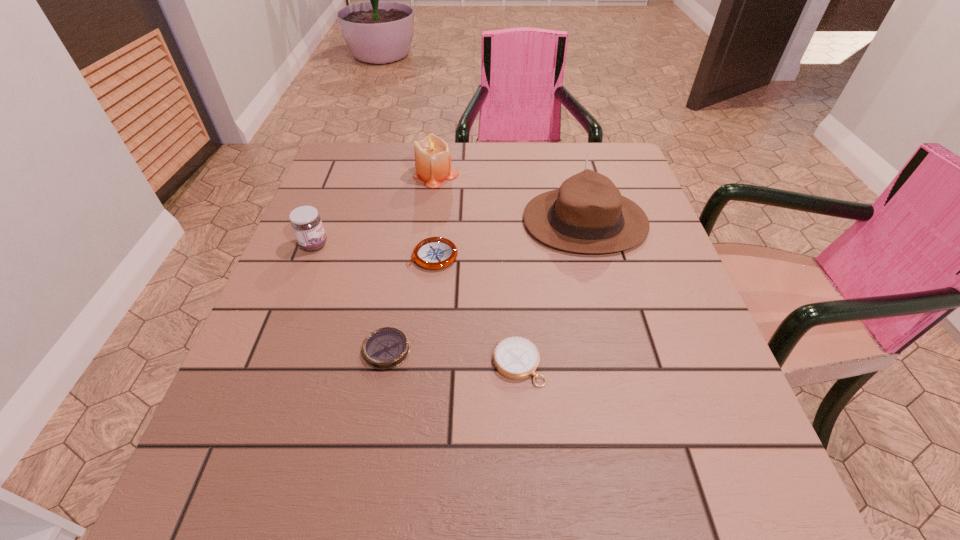
Locate an element on the screen. free region located on the feather side of the fedora is located at coordinates (494, 221).

The image size is (960, 540). Find the location of `free space located 0.280m on the front of the candle`. free space located 0.280m on the front of the candle is located at coordinates (425, 264).

Locate an element on the screen. This screenshot has height=540, width=960. free spot located on the front label of the leftmost object is located at coordinates (505, 245).

The height and width of the screenshot is (540, 960). I want to click on vacant space located on the back of the tallest compass, so click(440, 192).

The image size is (960, 540). What are the coordinates of `free space located on the right of the rightmost compass` in the screenshot? It's located at (617, 364).

At what (x,y) coordinates should I click in order to perform the action: click on blank space located on the front of the shortest object. Please return your answer as a coordinate pair (x, y). Looking at the image, I should click on (367, 463).

At what (x,y) coordinates should I click in order to perform the action: click on object positioned at the far edge. Please return your answer as a coordinate pair (x, y). Image resolution: width=960 pixels, height=540 pixels. Looking at the image, I should click on (432, 157).

Find the location of `object that is at the left edge`. object that is at the left edge is located at coordinates (306, 223).

The image size is (960, 540). What are the coordinates of `object present at the right edge` in the screenshot? It's located at (587, 214).

Identify the location of free space at the far edge of the desktop. The height and width of the screenshot is (540, 960). (540, 150).